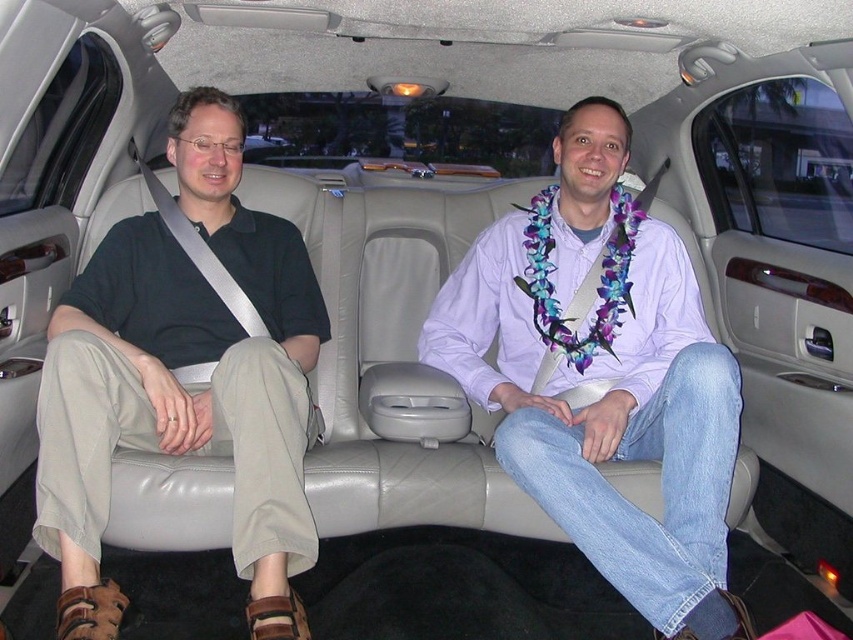
Between light purple shirt at center and dark green polo shirt at left, which one has less height?

Standing shorter between the two is dark green polo shirt at left.

Is light purple shirt at center positioned before dark green polo shirt at left?

No, it is not.

Identify the location of light purple shirt at center. (604, 378).

What are the coordinates of `light purple shirt at center` in the screenshot? It's located at (604, 378).